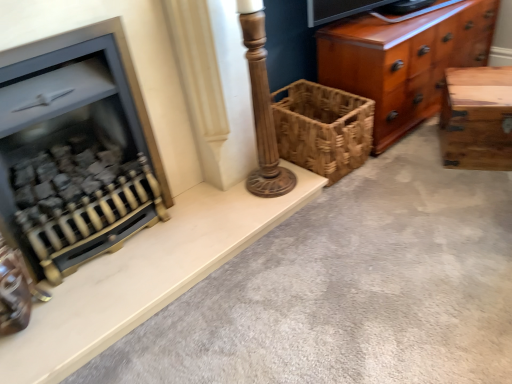
This screenshot has width=512, height=384. What do you see at coordinates (76, 150) in the screenshot?
I see `matte black fireplace at left` at bounding box center [76, 150].

What do you see at coordinates (144, 277) in the screenshot? This screenshot has width=512, height=384. I see `white marble fireplace at left` at bounding box center [144, 277].

The width and height of the screenshot is (512, 384). What do you see at coordinates (477, 118) in the screenshot?
I see `natural wood trunk at right` at bounding box center [477, 118].

Find the location of a particular element. matte black fireplace at left is located at coordinates (76, 150).

Between point (432, 50) and point (196, 193), which one is positioned behind?

Point (432, 50)

Considering their positions, is shiny brown wood chest of drawers at right located in front of or behind white marble fireplace at left?

In the image, shiny brown wood chest of drawers at right appears behind white marble fireplace at left.

From a real-world perspective, is shiny brown wood chest of drawers at right over white marble fireplace at left?

Correct, in the physical world, shiny brown wood chest of drawers at right is higher than white marble fireplace at left.

Does point (398, 91) come farther from viewer compared to point (335, 98)?

Yes, it is.

Considering the positions of objects shiny brown wood chest of drawers at right and woven brown basket at center in the image provided, who is more to the left, shiny brown wood chest of drawers at right or woven brown basket at center?

woven brown basket at center.

Which of these two, shiny brown wood chest of drawers at right or woven brown basket at center, is smaller?

woven brown basket at center is smaller.

From the image's perspective, is shiny brown wood chest of drawers at right located beneath woven brown basket at center?

Actually, shiny brown wood chest of drawers at right appears above woven brown basket at center in the image.

Which of these two, natural wood trunk at right or matte black fireplace at left, is bigger?

With larger size is matte black fireplace at left.

Based on the photo, from the image's perspective, between natural wood trunk at right and matte black fireplace at left, which one is located above?

From the image's view, natural wood trunk at right is above.

Which object is positioned more to the left, natural wood trunk at right or matte black fireplace at left?

From the viewer's perspective, matte black fireplace at left appears more on the left side.

In the image, is natural wood trunk at right positioned in front of or behind matte black fireplace at left?

In the image, natural wood trunk at right appears behind matte black fireplace at left.

Consider the image. Which of these two, natural wood trunk at right or white marble fireplace at left, is thinner?

natural wood trunk at right is thinner.

From the image's perspective, who appears lower, natural wood trunk at right or white marble fireplace at left?

white marble fireplace at left, from the image's perspective.

Can you tell me how much natural wood trunk at right and white marble fireplace at left differ in facing direction?

58.2 degrees.

Can you confirm if natural wood trunk at right is bigger than white marble fireplace at left?

Indeed, natural wood trunk at right has a larger size compared to white marble fireplace at left.

From a real-world perspective, does matte black fireplace at left sit lower than natural wood trunk at right?

No, from a real-world perspective, matte black fireplace at left is not beneath natural wood trunk at right.

Can you tell me how much matte black fireplace at left and natural wood trunk at right differ in facing direction?

The angle between the facing direction of matte black fireplace at left and the facing direction of natural wood trunk at right is 59.3 degrees.

Would you say matte black fireplace at left is inside or outside natural wood trunk at right?

matte black fireplace at left is spatially situated outside natural wood trunk at right.

Considering their positions, is matte black fireplace at left located in front of or behind natural wood trunk at right?

Visually, matte black fireplace at left is located in front of natural wood trunk at right.

Is shiny brown wood chest of drawers at right at the back of woven brown basket at center?

No, shiny brown wood chest of drawers at right is not at the back of woven brown basket at center.

This screenshot has height=384, width=512. I want to click on basket on the left of the shiny brown wood chest of drawers at right, so click(323, 128).

From a real-world perspective, who is located higher, woven brown basket at center or shiny brown wood chest of drawers at right?

From a 3D spatial view, shiny brown wood chest of drawers at right is above.

Is matte black fireplace at left to the left of wooden column at center from the viewer's perspective?

Yes.

Is matte black fireplace at left placed right next to wooden column at center?

No.

Is matte black fireplace at left facing away from wooden column at center?

matte black fireplace at left does not have its back to wooden column at center.

Locate an element on the screen. ledge directly beneath the shiny brown wood chest of drawers at right (from a real-world perspective) is located at coordinates (144, 277).

Find the location of `basket on the left of shiny brown wood chest of drawers at right`. basket on the left of shiny brown wood chest of drawers at right is located at coordinates (323, 128).

When comparing their distances from shiny brown wood chest of drawers at right, does white marble fireplace at left or natural wood trunk at right seem closer?

natural wood trunk at right is closer to shiny brown wood chest of drawers at right.

When comparing their distances from white marble fireplace at left, does wooden column at center or matte black fireplace at left seem further?

wooden column at center is positioned further to the anchor white marble fireplace at left.

Estimate the real-world distances between objects in this image. Which object is closer to wooden column at center, woven brown basket at center or natural wood trunk at right?

woven brown basket at center.

From the image, which object appears to be nearer to wooden column at center, woven brown basket at center or matte black fireplace at left?

woven brown basket at center is positioned closer to the anchor wooden column at center.

When comparing their distances from wooden column at center, does white marble fireplace at left or woven brown basket at center seem further?

white marble fireplace at left.

When comparing their distances from white marble fireplace at left, does natural wood trunk at right or woven brown basket at center seem further?

Based on the image, natural wood trunk at right appears to be further to white marble fireplace at left.

Which object lies further to the anchor point matte black fireplace at left, natural wood trunk at right or white marble fireplace at left?

natural wood trunk at right lies further to matte black fireplace at left than the other object.

Estimate the real-world distances between objects in this image. Which object is closer to white marble fireplace at left, shiny brown wood chest of drawers at right or natural wood trunk at right?

Based on the image, shiny brown wood chest of drawers at right appears to be nearer to white marble fireplace at left.

You are a GUI agent. You are given a task and a screenshot of the screen. Output one action in this format:
    pyautogui.click(x=<x>, y=<y>)
    Task: Click on the pillar located between white marble fireplace at left and shiny brown wood chest of drawers at right in the left-right direction
    
    Given the screenshot: What is the action you would take?
    pyautogui.click(x=262, y=107)

The image size is (512, 384). I want to click on basket situated between white marble fireplace at left and natural wood trunk at right from left to right, so click(x=323, y=128).

Where is `ledge situated between matte black fireplace at left and shiny brown wood chest of drawers at right from left to right`? The width and height of the screenshot is (512, 384). ledge situated between matte black fireplace at left and shiny brown wood chest of drawers at right from left to right is located at coordinates (144, 277).

Locate an element on the screen. The height and width of the screenshot is (384, 512). ledge between matte black fireplace at left and natural wood trunk at right from left to right is located at coordinates (144, 277).